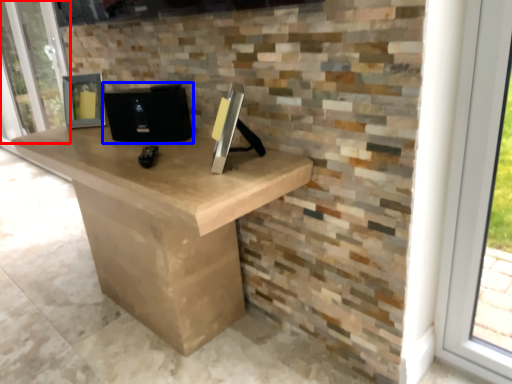
Question: Which object is closer to the camera taking this photo, screen door (highlighted by a red box) or computer (highlighted by a blue box)?

Choices:
 (A) screen door
 (B) computer

Answer: (B)